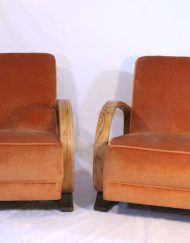
Where is `shadow across chair`? The height and width of the screenshot is (243, 190). shadow across chair is located at coordinates [24, 114].